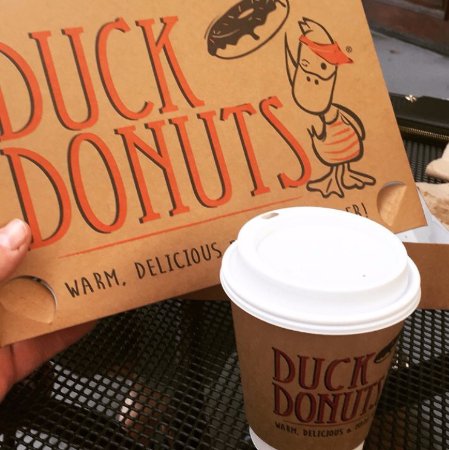
In order to click on black grate in this screenshot , I will do `click(170, 383)`.